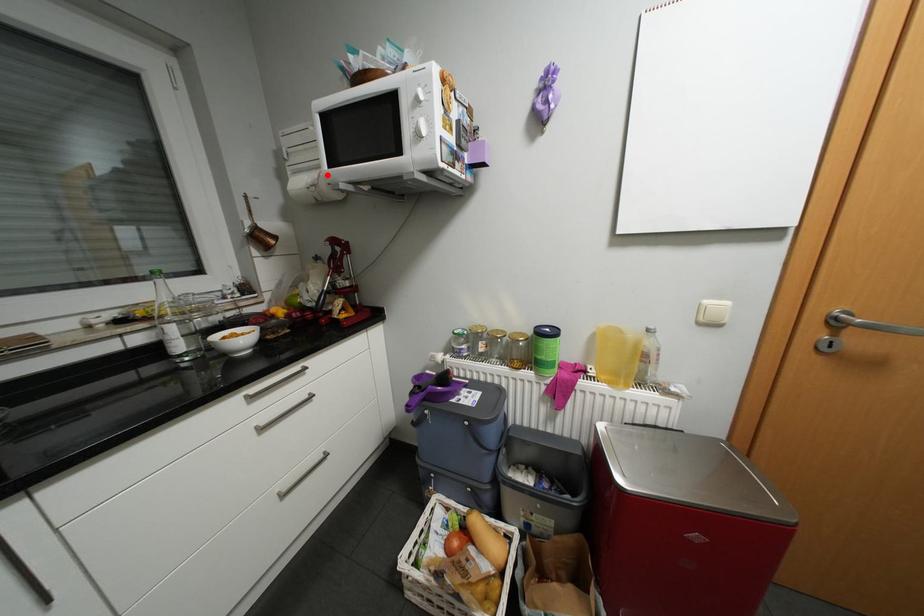
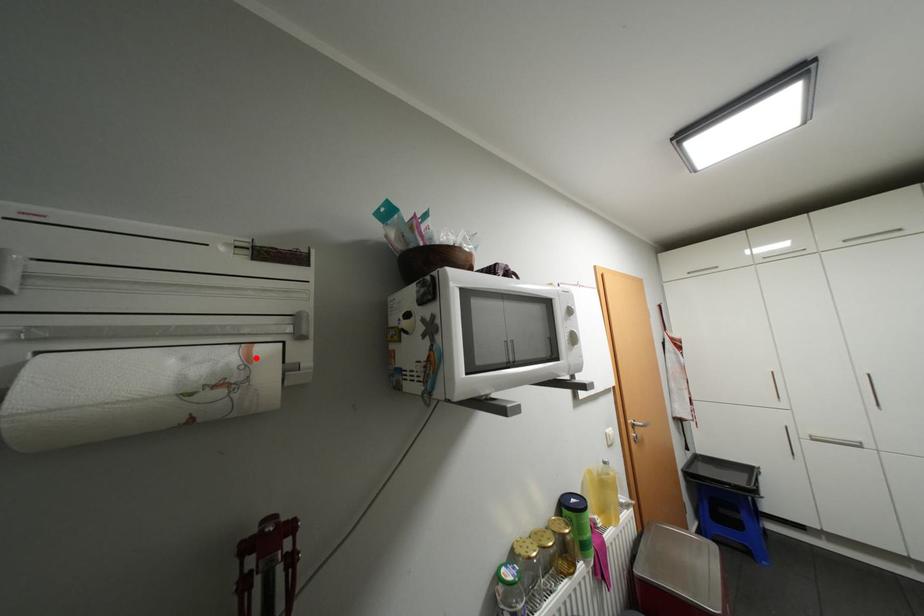
I am providing you with two images of the same scene from different viewpoints. A red point is marked on the first image and another point is marked on the second image. Is the marked point in image1 the same physical position as the marked point in image2?

Yes